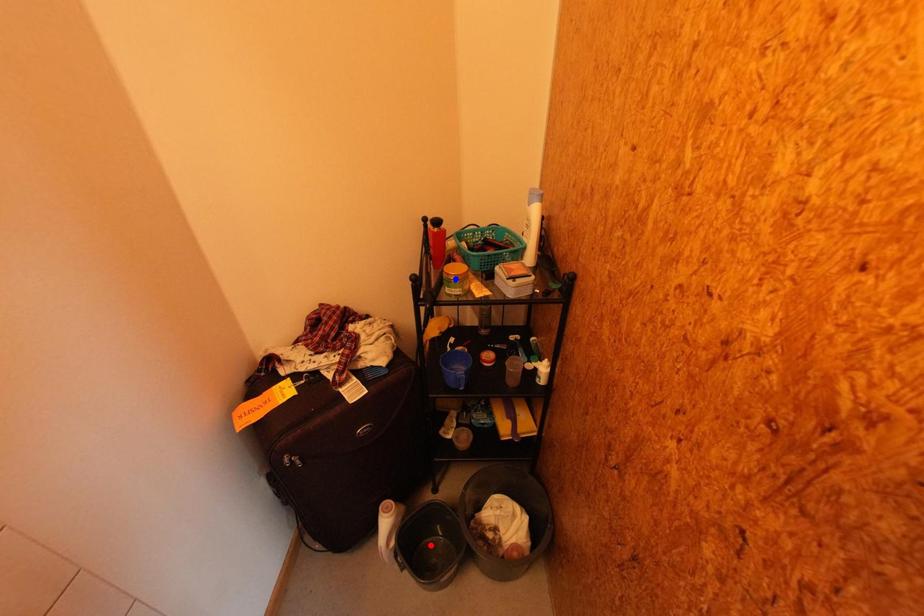
Question: Which of the two points in the image is closer to the camera?

Choices:
 (A) Blue point is closer.
 (B) Red point is closer.

Answer: (A)